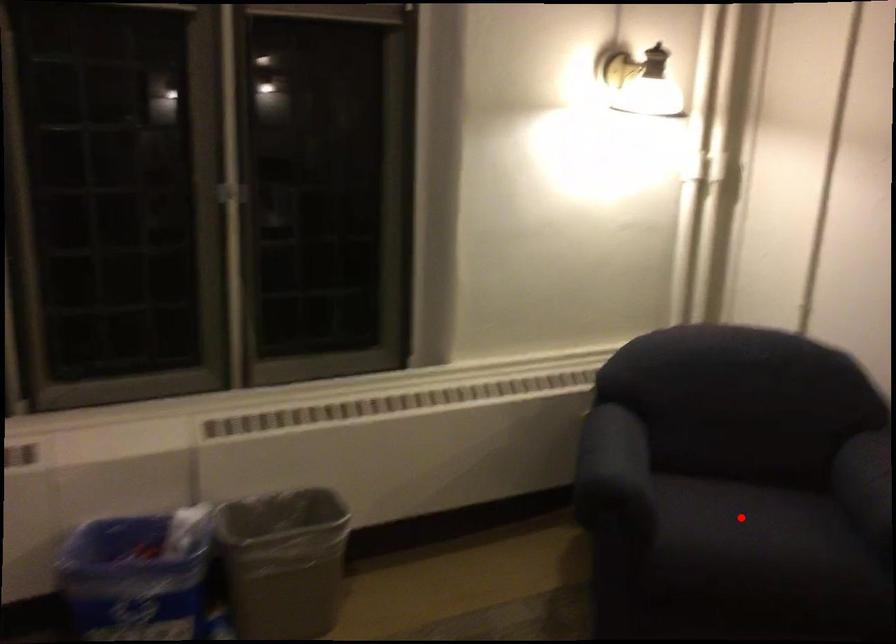
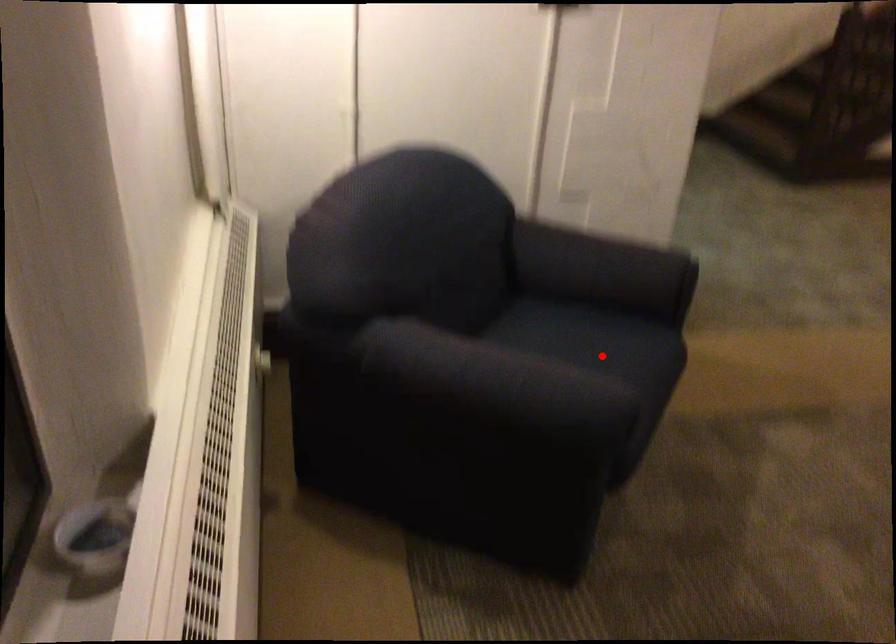
I am providing you with two images of the same scene from different viewpoints. A red point is marked on the first image and another point is marked on the second image. Is the red point in image1 aligned with the point shown in image2?

Yes